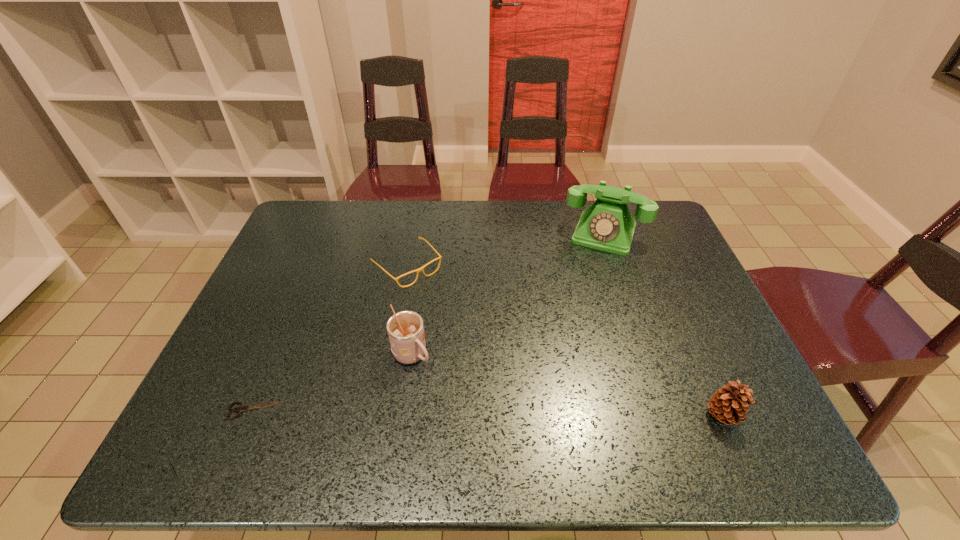
The image size is (960, 540). What are the coordinates of `the leftmost object` in the screenshot? It's located at (240, 409).

Identify the location of shears. (240, 409).

Locate an element on the screen. the third tallest object is located at coordinates (729, 405).

Locate an element on the screen. the second tallest object is located at coordinates tap(405, 329).

Image resolution: width=960 pixels, height=540 pixels. In order to click on the third farthest object in this screenshot , I will do `click(405, 329)`.

Locate an element on the screen. the tallest object is located at coordinates (607, 225).

At what (x,y) coordinates should I click in order to perform the action: click on the second shortest object. Please return your answer as a coordinate pair (x, y). The width and height of the screenshot is (960, 540). Looking at the image, I should click on (422, 268).

I want to click on vacant area located 0.240m on the back of the shears, so click(292, 320).

What are the coordinates of `free space located 0.310m on the left of the third shortest object` in the screenshot? It's located at coord(560,416).

Locate an element on the screen. vacant space situated on the side with the handle of the third farthest object is located at coordinates (x=471, y=413).